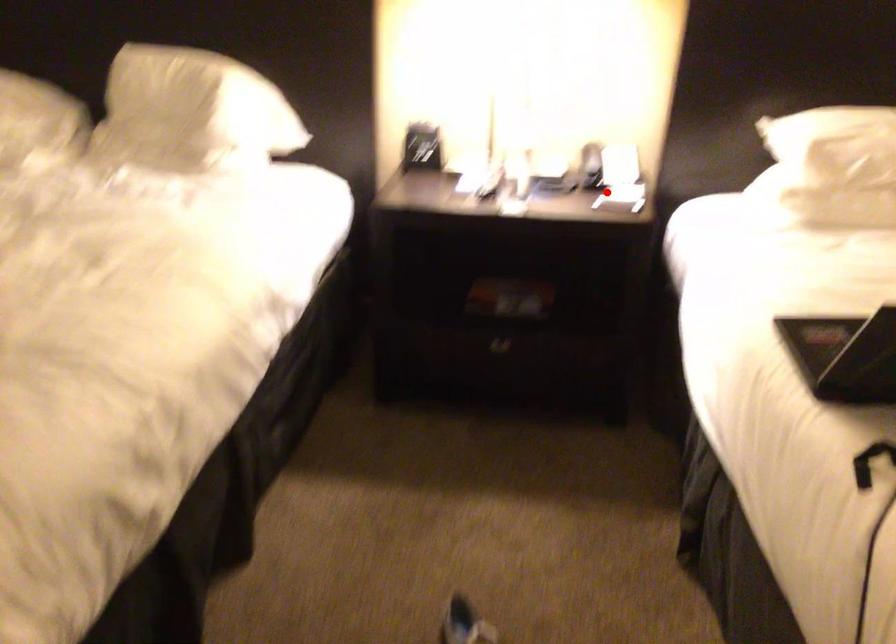
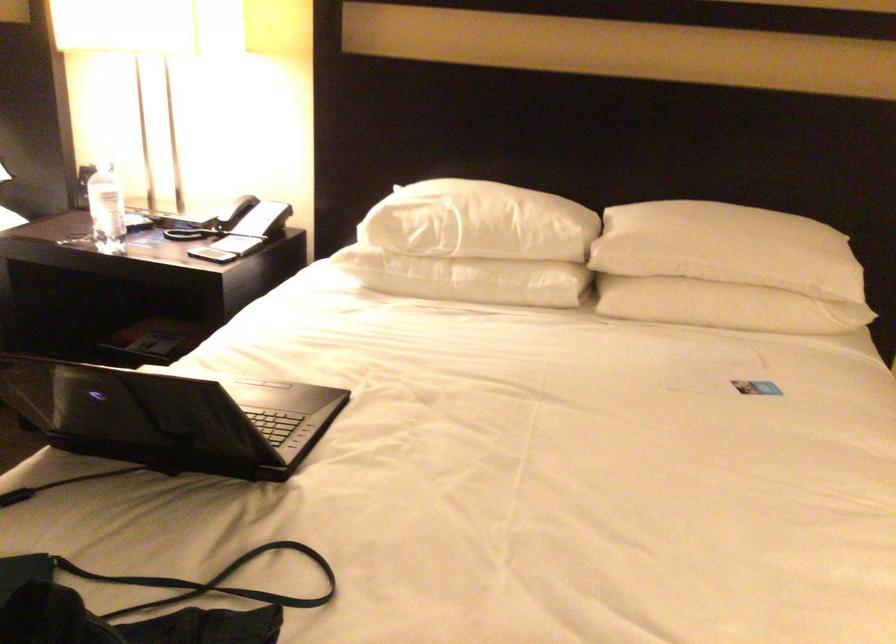
In the second image, find the point that corresponds to the highlighted location in the first image.

(211, 249)